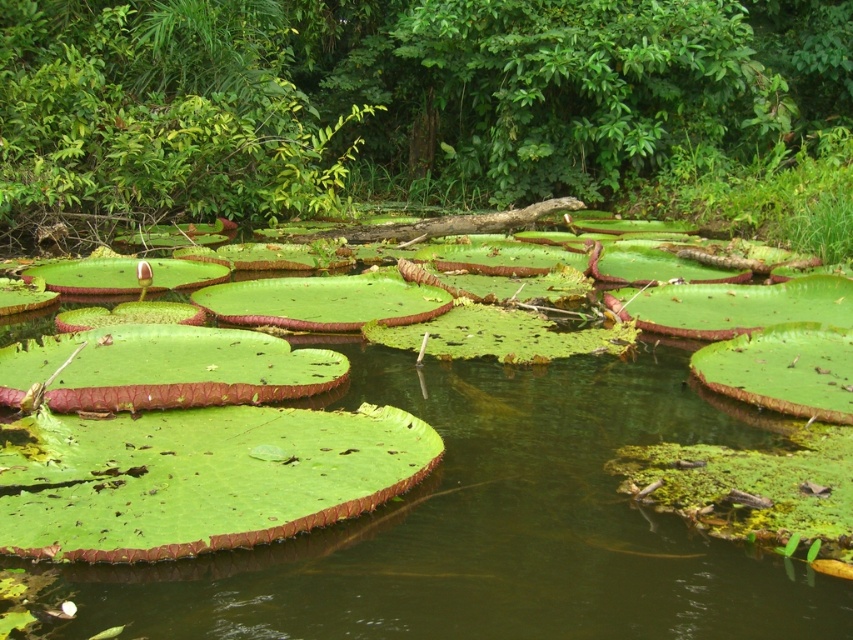
You are standing at the edge of the pond and want to take a photo of both the point at coordinates [115,3] and the point at [672,433]. Which point will appear closer to you in the photo?

The point at coordinates [115,3] will appear closer to you in the photo because it is further to the camera than point [672,433].

Consider the image. You are standing at the edge of the pond and notice the green leathery leaves at center and the green leafy water at center. Which object is positioned higher relative to the other?

The green leathery leaves at center are located above the green leafy water at center, so they are positioned higher.

From the picture: You are standing on a wooden bridge that overlooks the pond. You notice the green leathery leaves at center and the green leafy water at center. Which object is closer to you from your vantage point on the bridge?

The green leathery leaves at center are closer to you because the green leafy water at center is positioned behind them.